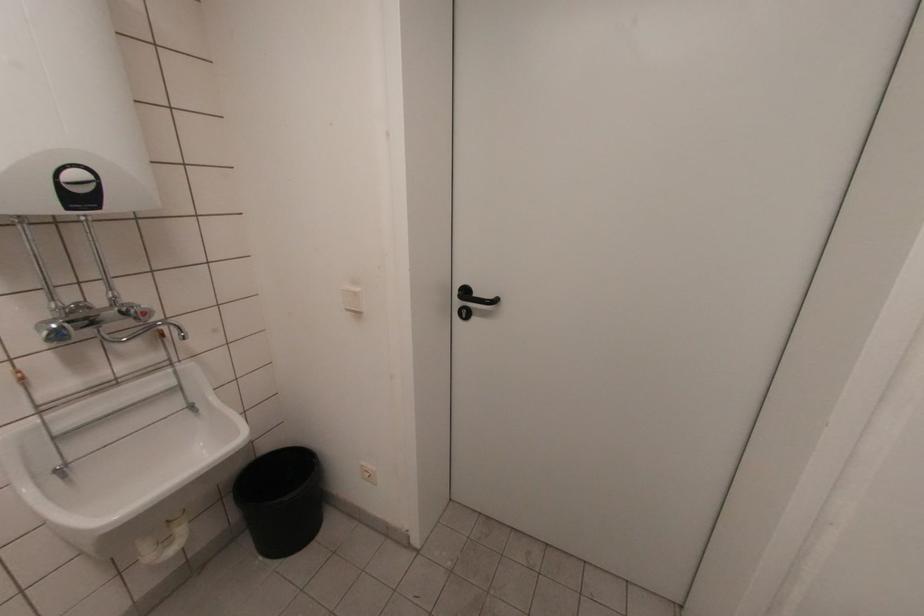
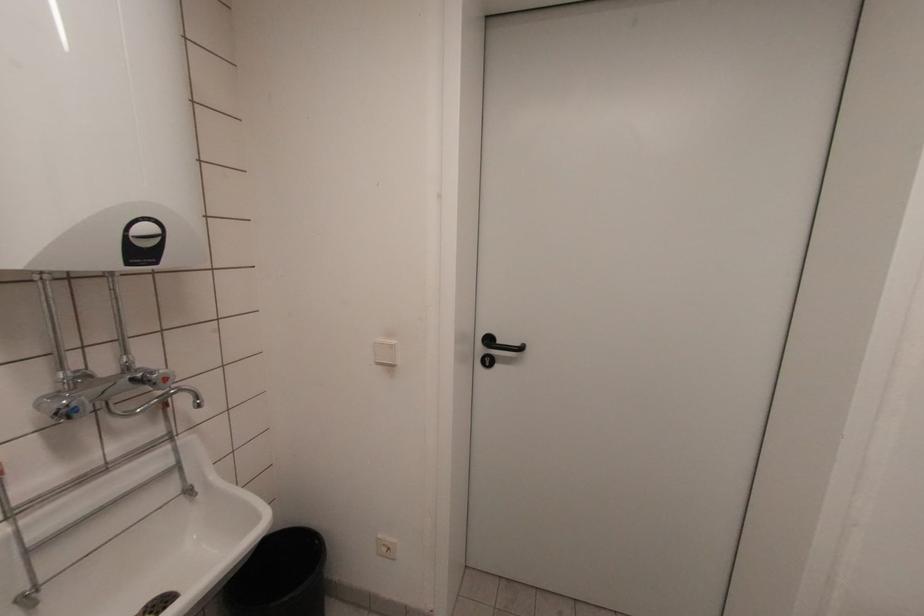
Question: Which direction would the cameraman need to move to produce the second image? Reply with the corresponding letter.

Choices:
 (A) Left
 (B) Right
 (C) Forward
 (D) Backward

Answer: (A)